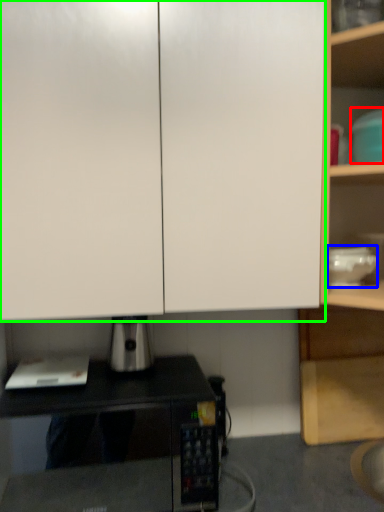
Question: Which object is the closest to the appliance (highlighted by a red box)? Choose among these: appliance (highlighted by a blue box) or cabinetry (highlighted by a green box).

Choices:
 (A) appliance
 (B) cabinetry

Answer: (A)